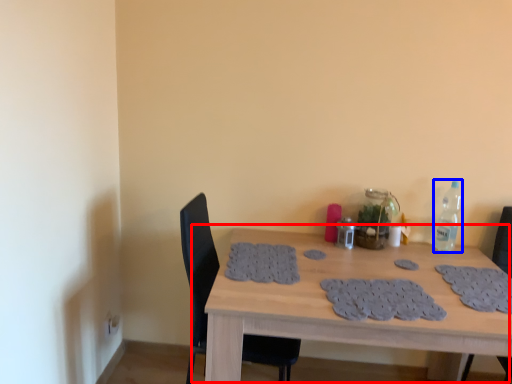
Question: Which point is closer to the camera, table (highlighted by a red box) or bottle (highlighted by a blue box)?

Choices:
 (A) table
 (B) bottle

Answer: (A)